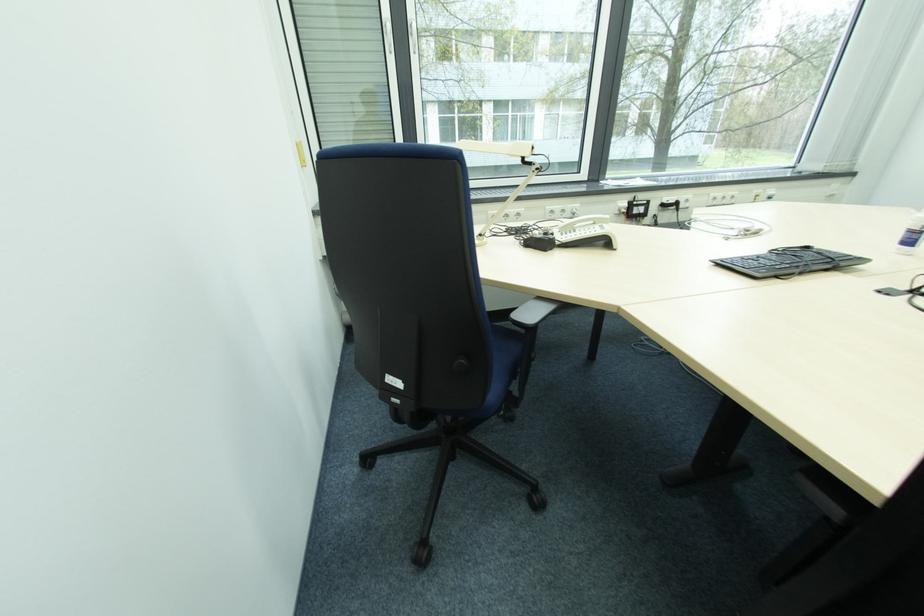
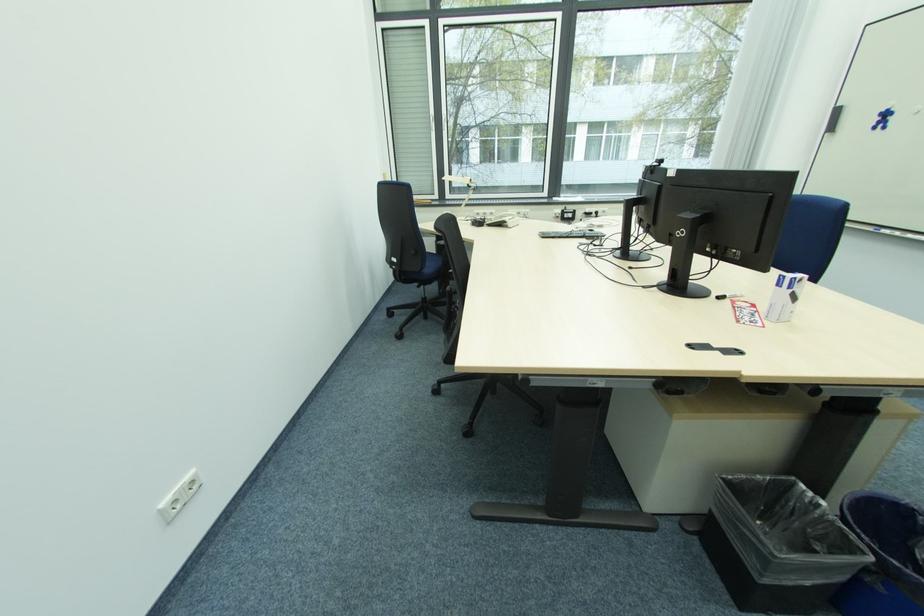
The point at (521, 216) is marked in the first image. Where is the corresponding point in the second image?

(494, 216)